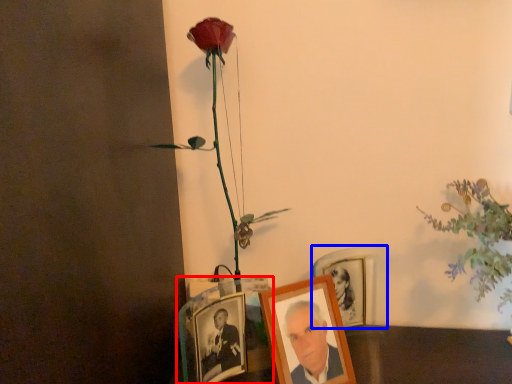
Question: Which object is further to the camera taking this photo, picture frame (highlighted by a red box) or picture frame (highlighted by a blue box)?

Choices:
 (A) picture frame
 (B) picture frame

Answer: (B)